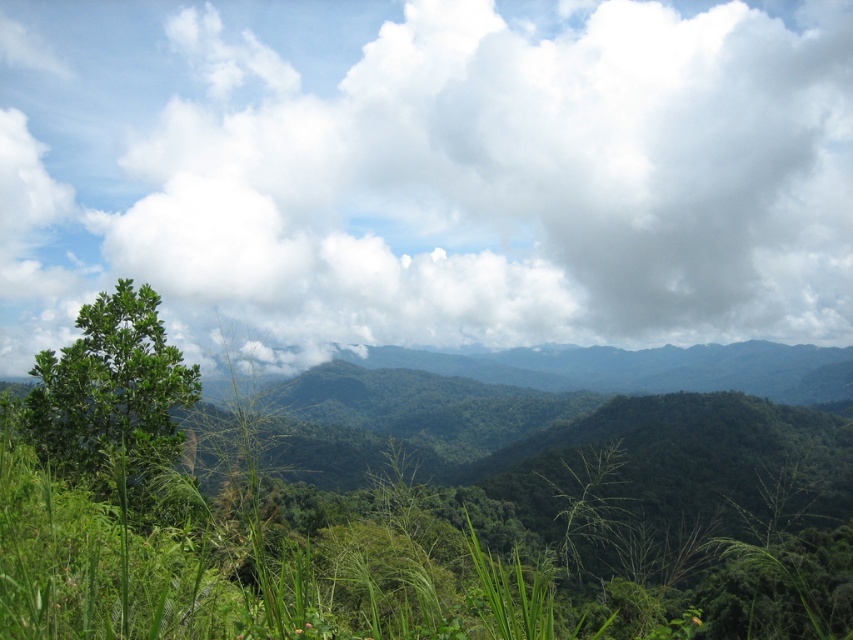
You are standing in the lush landscape and want to determine which object is taller between the white fluffy cloud at upper center and the green leafy tree at left. Based on the scene, can you identify which one is taller?

The white fluffy cloud at upper center is taller than the green leafy tree at left according to the description.

Looking at this image, looking at the scene, which object is positioned to the right of the other between the white fluffy cloud at upper center and the green leafy tree at left?

The white fluffy cloud at upper center is positioned to the right of the green leafy tree at left.